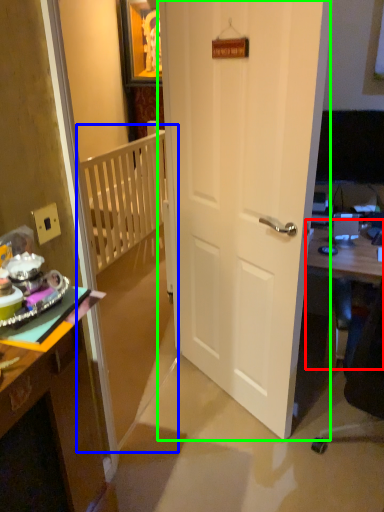
Question: Which is nearer to the table (highlighted by a red box)? bunk bed (highlighted by a blue box) or door (highlighted by a green box).

Choices:
 (A) bunk bed
 (B) door

Answer: (B)